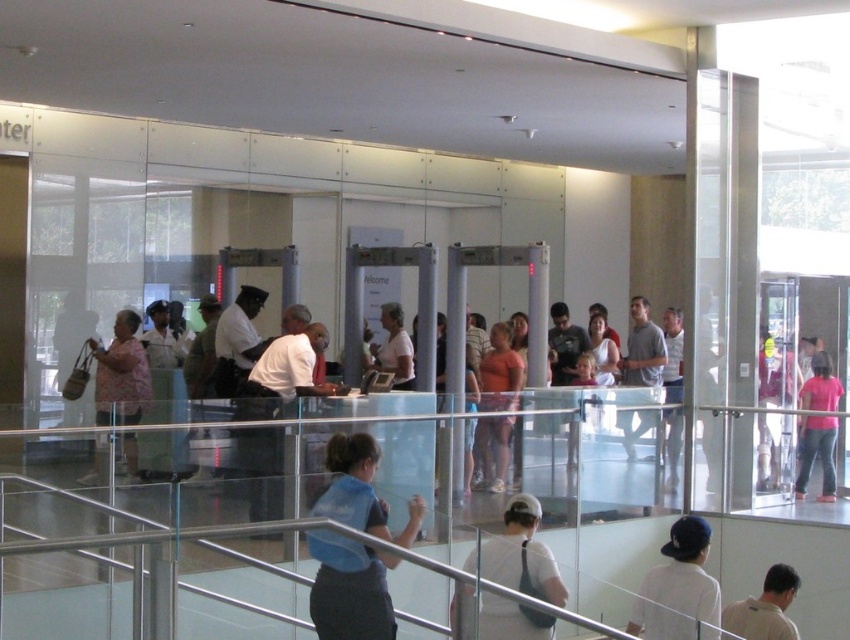
Which of these two, blue fabric at center or white matte uniform at center, stands taller?

blue fabric at center

Who is more forward, (340, 474) or (280, 387)?

Point (340, 474)

You are a GUI agent. You are given a task and a screenshot of the screen. Output one action in this format:
    pyautogui.click(x=<x>, y=<y>)
    Task: Click on the blue fabric at center
    The width and height of the screenshot is (850, 640).
    Given the screenshot: What is the action you would take?
    pyautogui.click(x=349, y=588)

Who is more distant from viewer, (x=718, y=611) or (x=823, y=444)?

The point (x=823, y=444) is behind.

Who is more forward, (x=672, y=625) or (x=826, y=492)?

Positioned in front is point (x=672, y=625).

This screenshot has height=640, width=850. In order to click on white matte cap at upper center in this screenshot , I will do `click(680, 588)`.

Does pink fabric shirt at right appear under light brown shirt at lower right?

No.

Is pink fabric shirt at right shorter than light brown shirt at lower right?

No, pink fabric shirt at right is not shorter than light brown shirt at lower right.

Find the location of a particular element. The height and width of the screenshot is (640, 850). pink fabric shirt at right is located at coordinates (816, 452).